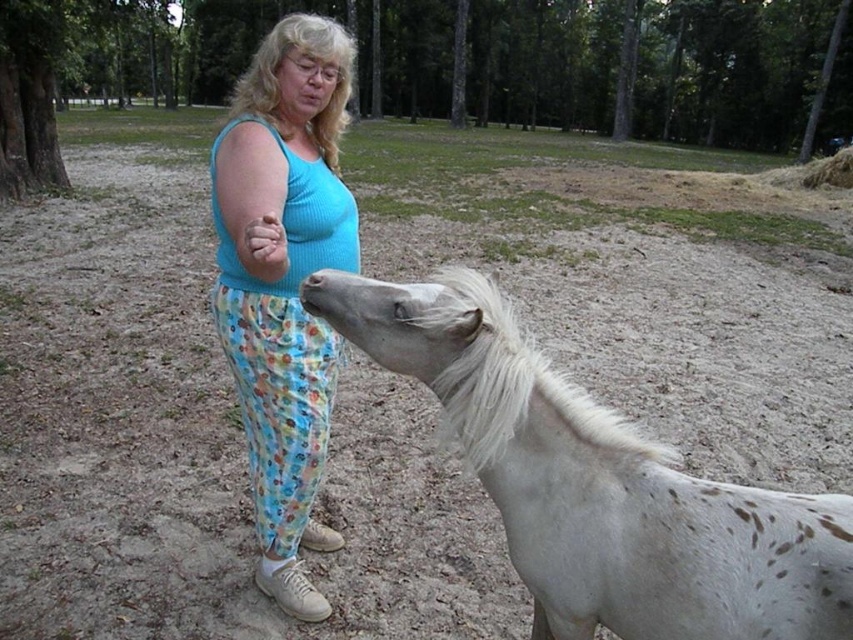
You are a photographer positioned at the center of the scene. You want to capture both the point at (x=751, y=604) and the point at (x=268, y=106) in your shot. Which point is closer to your camera?

Point (x=751, y=604) is closer to the viewer than point (x=268, y=106), so it will appear nearer in the photograph.

You are standing in the park and see the point at coordinates (796, 525). If you want to place a small bench there, will it be within your immediate viewing area?

The point at coordinates (796, 525) is 4.88 feet away from the viewer, so placing a small bench there would be within your immediate viewing area since it is relatively close.